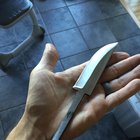
This screenshot has height=140, width=140. I want to click on tile surface, so click(x=86, y=36).